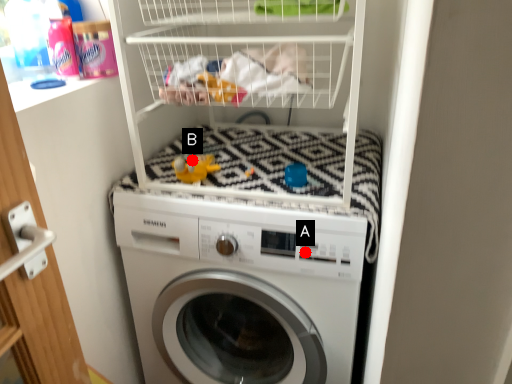
Question: Two points are circled on the image, labeled by A and B beside each circle. Among these points, which one is nearest to the camera?

Choices:
 (A) A is closer
 (B) B is closer

Answer: (A)